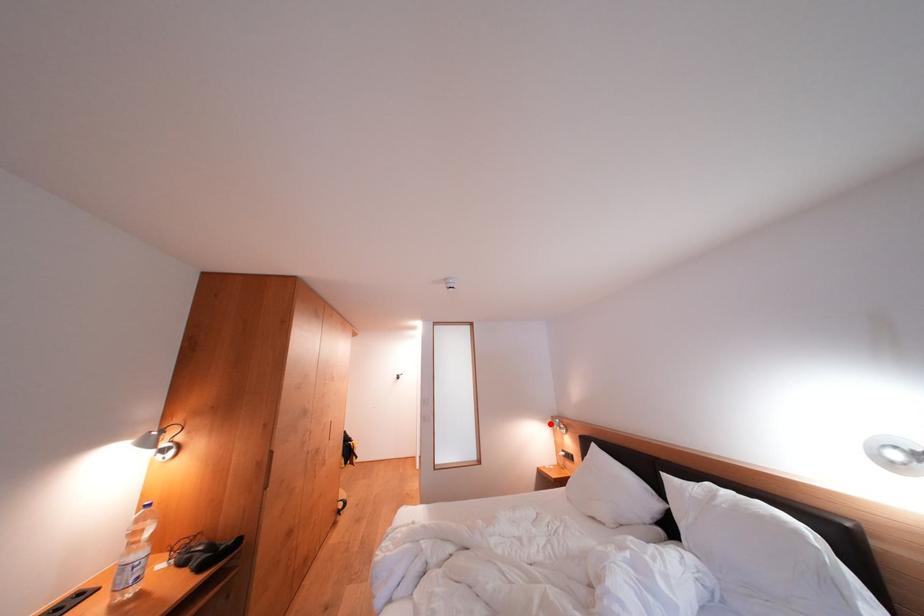
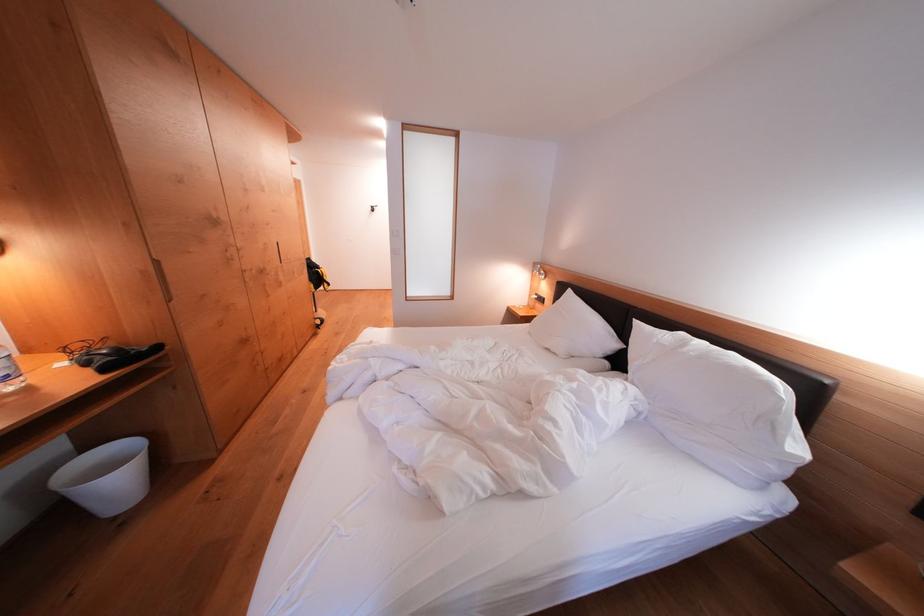
Locate, in the second image, the point that corresponds to the highlighted location in the first image.

(531, 269)